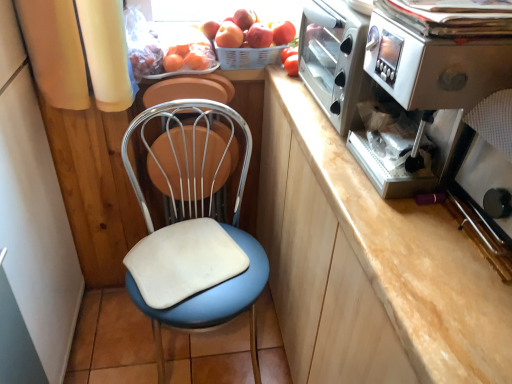
What do you see at coordinates (291, 65) in the screenshot? This screenshot has height=384, width=512. I see `red matte tomato at upper right` at bounding box center [291, 65].

The image size is (512, 384). What do you see at coordinates (190, 89) in the screenshot? I see `metallic wire chair at center` at bounding box center [190, 89].

The height and width of the screenshot is (384, 512). Describe the element at coordinates (247, 57) in the screenshot. I see `plastic basket at upper center` at that location.

What do you see at coordinates (229, 35) in the screenshot?
I see `smooth red apple at upper center, the 3th apple viewed from the right` at bounding box center [229, 35].

Describe the element at coordinates (437, 64) in the screenshot. I see `satin silver coffee machine at right` at that location.

What are the coordinates of `red matte tomato at upper right` in the screenshot? It's located at (291, 65).

From the image's perspective, is red matte tomato at upper right located above white leatherette chair at center?

Yes.

At what (x,y) coordinates should I click in order to perform the action: click on chair below the red matte tomato at upper right (from a real-world perspective). Please return your answer as a coordinate pair (x, y). The width and height of the screenshot is (512, 384). Looking at the image, I should click on (194, 232).

Is white leatherette chair at center surrounded by red matte tomato at upper right?

No, white leatherette chair at center is not a part of red matte tomato at upper right.

Can you confirm if red matte tomato at upper right is positioned to the left of white leatherette chair at center?

No, red matte tomato at upper right is not to the left of white leatherette chair at center.

Considering the sizes of objects red matte apple at upper center, the 3th apple when ordered from left to right, and white leatherette chair at center in the image provided, who is wider, red matte apple at upper center, the 3th apple when ordered from left to right, or white leatherette chair at center?

Wider between the two is white leatherette chair at center.

From a real-world perspective, is red matte apple at upper center, placed as the 1th apple when sorted from right to left, beneath white leatherette chair at center?

No, from a real-world perspective, red matte apple at upper center, placed as the 1th apple when sorted from right to left, is not under white leatherette chair at center.

Is point (291, 33) positioned after point (202, 241)?

Yes.

Is red matte apple at upper center, the 3th apple when ordered from left to right, inside the boundaries of white leatherette chair at center, or outside?

red matte apple at upper center, the 3th apple when ordered from left to right, cannot be found inside white leatherette chair at center.

Is red matte apple at upper center, arranged as the second apple when viewed from the right, thinner than satin silver coffee machine at right?

Correct, the width of red matte apple at upper center, arranged as the second apple when viewed from the right, is less than that of satin silver coffee machine at right.

From a real-world perspective, is red matte apple at upper center, arranged as the 2th apple when viewed from the left, physically above satin silver coffee machine at right?

Incorrect, from a real-world perspective, red matte apple at upper center, arranged as the 2th apple when viewed from the left, is lower than satin silver coffee machine at right.

Is red matte apple at upper center, arranged as the 2th apple when viewed from the left, oriented towards satin silver coffee machine at right?

No, red matte apple at upper center, arranged as the 2th apple when viewed from the left, does not turn towards satin silver coffee machine at right.

Between point (258, 30) and point (382, 196), which one is positioned in front?

Positioned in front is point (382, 196).

Considering the relative sizes of plastic basket at upper center and red matte apple at upper center, arranged as the 2th apple when viewed from the left, in the image provided, is plastic basket at upper center bigger than red matte apple at upper center, arranged as the 2th apple when viewed from the left,?

Indeed, plastic basket at upper center has a larger size compared to red matte apple at upper center, arranged as the 2th apple when viewed from the left.

Is plastic basket at upper center behind red matte apple at upper center, arranged as the 2th apple when viewed from the left?

Yes, it is behind red matte apple at upper center, arranged as the 2th apple when viewed from the left.

How distant is plastic basket at upper center from red matte apple at upper center, arranged as the second apple when viewed from the right?

2.10 inches.

From a real-world perspective, is plastic basket at upper center located higher than red matte apple at upper center, arranged as the second apple when viewed from the right?

No.

Considering the sizes of objects metallic wire chair at center and white leatherette chair at center in the image provided, who is bigger, metallic wire chair at center or white leatherette chair at center?

With larger size is white leatherette chair at center.

Is metallic wire chair at center completely or partially outside of white leatherette chair at center?

metallic wire chair at center lies outside white leatherette chair at center's area.

From a real-world perspective, is metallic wire chair at center over white leatherette chair at center?

Yes, from a real-world perspective, metallic wire chair at center is above white leatherette chair at center.

Based on the photo, from the image's perspective, which one is positioned higher, metallic wire chair at center or white leatherette chair at center?

metallic wire chair at center appears higher in the image.

Which of these two, red matte apple at upper center, placed as the 1th apple when sorted from right to left, or metallic wire chair at center, is thinner?

Thinner between the two is metallic wire chair at center.

Does red matte apple at upper center, placed as the 1th apple when sorted from right to left, have a lesser height compared to metallic wire chair at center?

Indeed, red matte apple at upper center, placed as the 1th apple when sorted from right to left, has a lesser height compared to metallic wire chair at center.

Considering the relative positions of red matte apple at upper center, placed as the 1th apple when sorted from right to left, and metallic wire chair at center in the image provided, is red matte apple at upper center, placed as the 1th apple when sorted from right to left, to the left or to the right of metallic wire chair at center?

Based on their positions, red matte apple at upper center, placed as the 1th apple when sorted from right to left, is located to the right of metallic wire chair at center.

From the image's perspective, does red matte apple at upper center, the 3th apple when ordered from left to right, appear lower than metallic wire chair at center?

Incorrect, from the image's perspective, red matte apple at upper center, the 3th apple when ordered from left to right, is higher than metallic wire chair at center.

Find the location of `basket behind the red matte apple at upper center, placed as the 1th apple when sorted from right to left`. basket behind the red matte apple at upper center, placed as the 1th apple when sorted from right to left is located at coordinates pyautogui.click(x=247, y=57).

Can you confirm if plastic basket at upper center is bigger than red matte apple at upper center, the 3th apple when ordered from left to right?

Indeed, plastic basket at upper center has a larger size compared to red matte apple at upper center, the 3th apple when ordered from left to right.

Is plastic basket at upper center inside or outside of red matte apple at upper center, placed as the 1th apple when sorted from right to left?

plastic basket at upper center is not enclosed by red matte apple at upper center, placed as the 1th apple when sorted from right to left.

Considering the relative sizes of plastic basket at upper center and red matte apple at upper center, the 3th apple when ordered from left to right, in the image provided, is plastic basket at upper center wider than red matte apple at upper center, the 3th apple when ordered from left to right,?

Correct, the width of plastic basket at upper center exceeds that of red matte apple at upper center, the 3th apple when ordered from left to right.

Identify the location of chair lying on the left of red matte tomato at upper right. (194, 232).

The width and height of the screenshot is (512, 384). What are the coordinates of `chair in front of the red matte apple at upper center, placed as the 1th apple when sorted from right to left` in the screenshot? It's located at (194, 232).

From the image, which object appears to be nearer to satin silver coffee machine at right, red matte tomato at upper right or red matte apple at upper center, placed as the 1th apple when sorted from right to left?

Among the two, red matte tomato at upper right is located nearer to satin silver coffee machine at right.

Based on their spatial positions, is red matte apple at upper center, placed as the 1th apple when sorted from right to left, or red matte apple at upper center, arranged as the second apple when viewed from the right, further from red matte tomato at upper right?

red matte apple at upper center, arranged as the second apple when viewed from the right, is positioned further to the anchor red matte tomato at upper right.

Estimate the real-world distances between objects in this image. Which object is further from plastic basket at upper center, smooth red apple at upper center, which is the first apple in left-to-right order, or metallic wire chair at center?

metallic wire chair at center.

Which object lies nearer to the anchor point smooth red apple at upper center, which is the first apple in left-to-right order, satin silver coffee machine at right or red matte apple at upper center, arranged as the 2th apple when viewed from the left?

red matte apple at upper center, arranged as the 2th apple when viewed from the left, is closer to smooth red apple at upper center, which is the first apple in left-to-right order.

Estimate the real-world distances between objects in this image. Which object is closer to plastic basket at upper center, red matte apple at upper center, placed as the 1th apple when sorted from right to left, or satin silver coffee machine at right?

red matte apple at upper center, placed as the 1th apple when sorted from right to left, lies closer to plastic basket at upper center than the other object.

In the scene shown: Estimate the real-world distances between objects in this image. Which object is further from white leatherette chair at center, red matte apple at upper center, placed as the 1th apple when sorted from right to left, or metallic wire chair at center?

Among the two, red matte apple at upper center, placed as the 1th apple when sorted from right to left, is located further to white leatherette chair at center.

Based on their spatial positions, is plastic basket at upper center or metallic wire chair at center further from red matte apple at upper center, placed as the 1th apple when sorted from right to left?

The object further to red matte apple at upper center, placed as the 1th apple when sorted from right to left, is metallic wire chair at center.

Considering their positions, is smooth red apple at upper center, the 3th apple viewed from the right, positioned closer to plastic basket at upper center than white leatherette chair at center?

Based on the image, smooth red apple at upper center, the 3th apple viewed from the right, appears to be nearer to plastic basket at upper center.

Find the location of a particular element. Image resolution: width=512 pixels, height=384 pixels. chair located between satin silver coffee machine at right and plastic basket at upper center in the depth direction is located at coordinates (194, 232).

I want to click on chair between satin silver coffee machine at right and smooth red apple at upper center, the 3th apple viewed from the right, in the front-back direction, so click(x=194, y=232).

Locate an element on the screen. The width and height of the screenshot is (512, 384). armchair between red matte tomato at upper right and white leatherette chair at center in the vertical direction is located at coordinates (190, 89).

Identify the location of armchair between satin silver coffee machine at right and red matte apple at upper center, arranged as the second apple when viewed from the right, from front to back. The width and height of the screenshot is (512, 384). (190, 89).